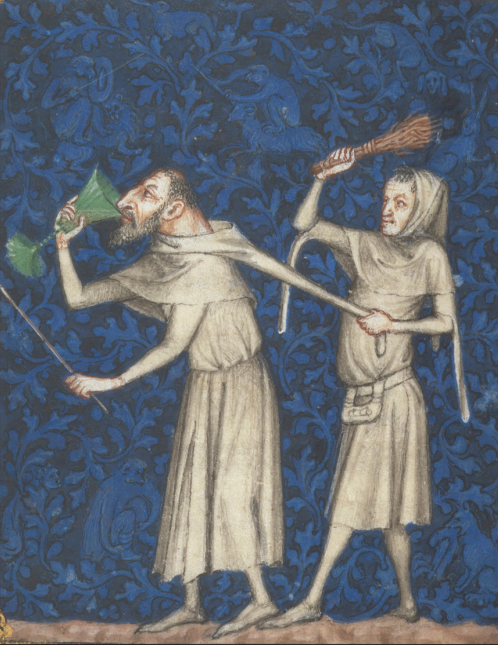
Locate an element on the screen. This screenshot has width=498, height=645. robes is located at coordinates (260, 417), (410, 459).